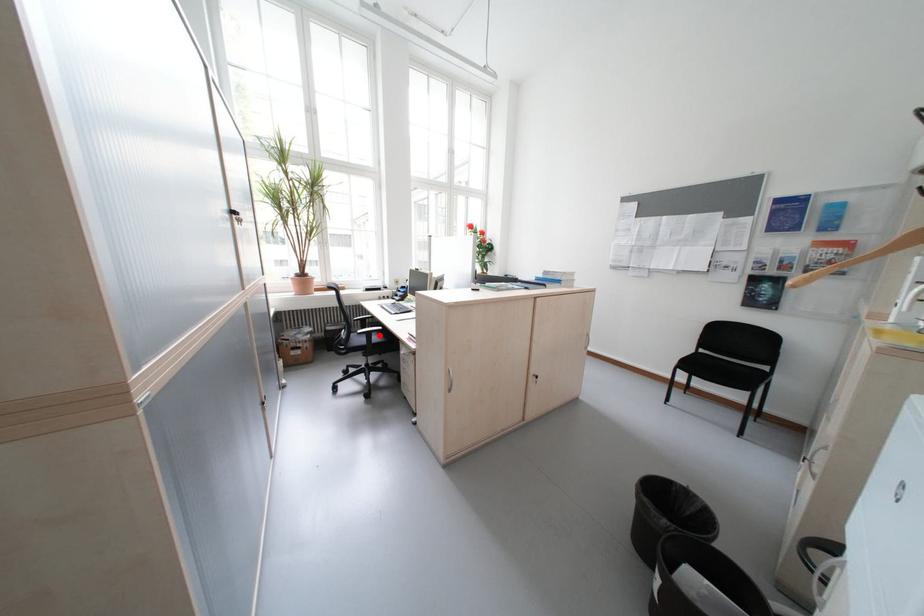
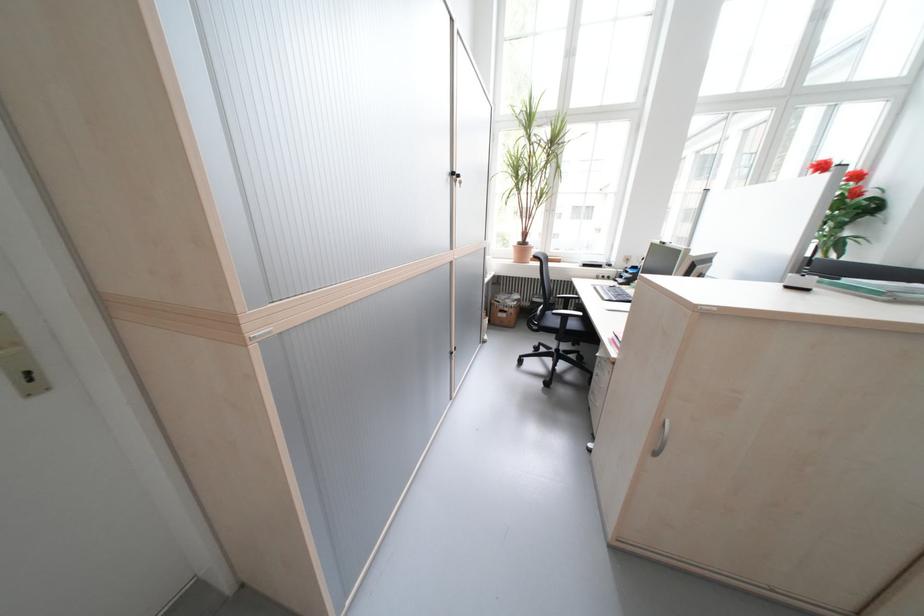
Locate, in the second image, the point that corresponds to the highlighted location in the first image.

(575, 318)